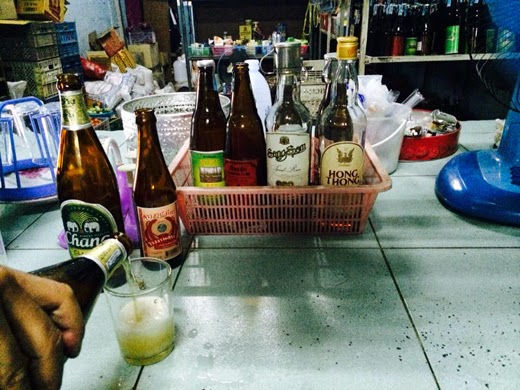
Locate an element on the screen. bottles is located at coordinates (236, 149).